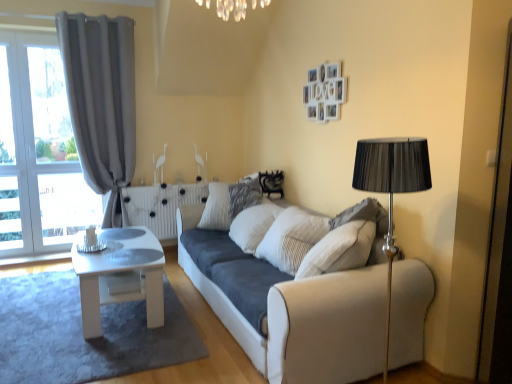
Question: From a real-world perspective, is white glossy coffee table at lower left above or below suede-like beige pillow at right?

Choices:
 (A) below
 (B) above

Answer: (A)

Question: Considering the positions of white glossy coffee table at lower left and suede-like beige pillow at right in the image, is white glossy coffee table at lower left taller or shorter than suede-like beige pillow at right?

Choices:
 (A) short
 (B) tall

Answer: (A)

Question: Estimate the real-world distances between objects in this image. Which object is farther from the gray fabric curtain at left?

Choices:
 (A) white glossy table at center
 (B) white glossy coffee table at lower left
 (C) white fabric couch at center
 (D) suede-like beige pillow at right

Answer: (D)

Question: Estimate the real-world distances between objects in this image. Which object is farther from the white glossy table at center?

Choices:
 (A) white glossy coffee table at lower left
 (B) suede-like beige pillow at right
 (C) gray fabric curtain at left
 (D) white fabric couch at center

Answer: (B)